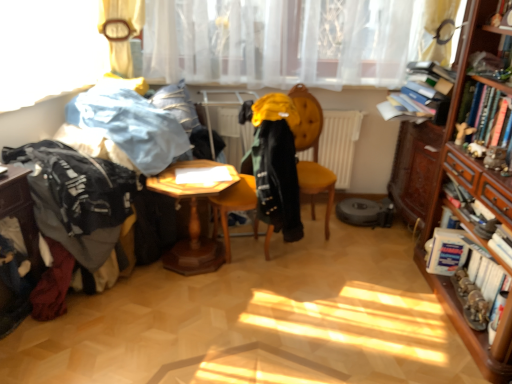
This screenshot has height=384, width=512. Identify the location of vacant region under velvet yellow chair at center (from a real-world perspective). (312, 232).